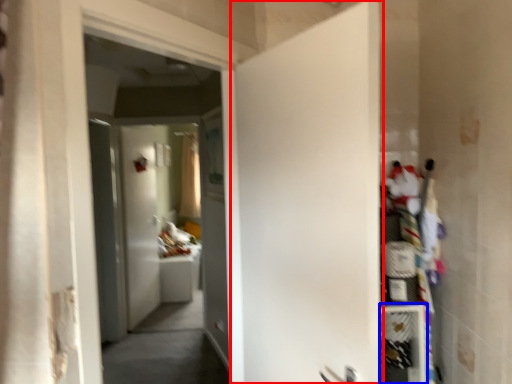
Question: Which of the following is the farthest to the observer, door (highlighted by a red box) or shelf (highlighted by a blue box)?

Choices:
 (A) door
 (B) shelf

Answer: (B)